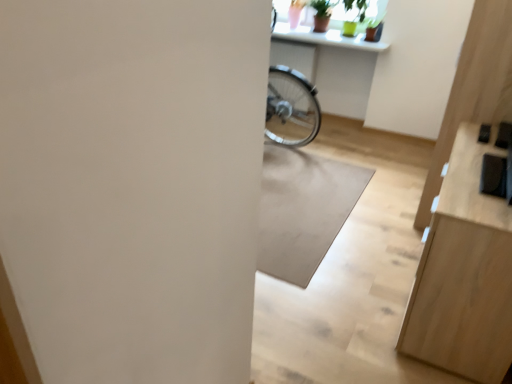
Locate an element on the screen. The image size is (512, 384). free point behind light wood dresser at right is located at coordinates (389, 231).